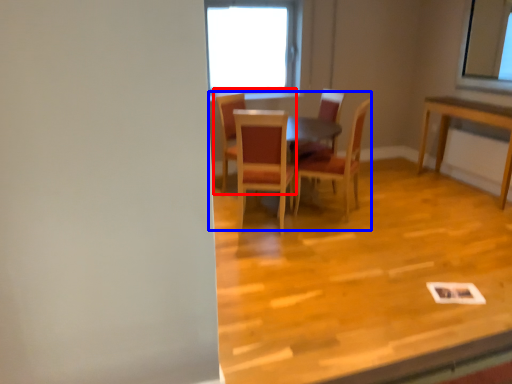
Question: Which of the following is the closest to the observer, chair (highlighted by a red box) or table (highlighted by a blue box)?

Choices:
 (A) chair
 (B) table

Answer: (B)